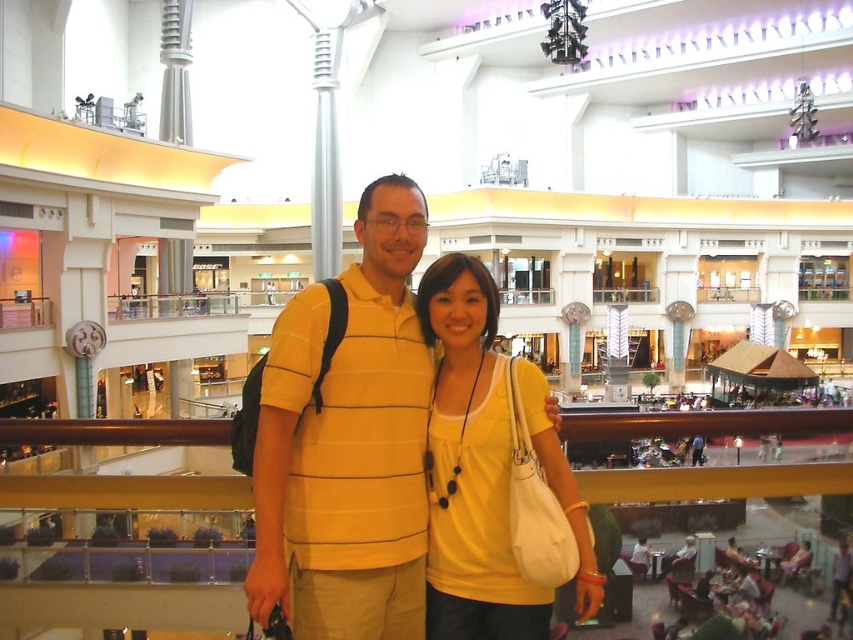
Can you confirm if yellow striped polo shirt at center is smaller than yellow matte tank top at center?

Actually, yellow striped polo shirt at center might be larger than yellow matte tank top at center.

Which is in front, point (424, 371) or point (445, 488)?

Point (445, 488)

The image size is (853, 640). Find the location of `yellow striped polo shirt at center`. yellow striped polo shirt at center is located at coordinates (347, 440).